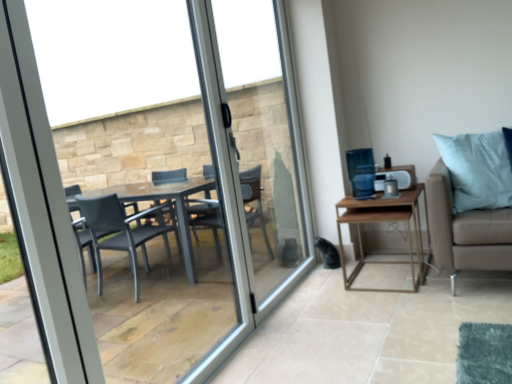
Question: Choose the correct answer: Is transparent glass window at center inside wooden table at right or outside it?

Choices:
 (A) outside
 (B) inside

Answer: (A)

Question: From a real-world perspective, relative to wooden table at right, is transparent glass window at center vertically above or below?

Choices:
 (A) above
 (B) below

Answer: (A)

Question: Which is farther from the wooden table at right?

Choices:
 (A) clear glass door at center
 (B) transparent glass window at center

Answer: (B)

Question: Based on their relative distances, which object is farther from the transparent glass window at center?

Choices:
 (A) clear glass door at center
 (B) wooden table at right

Answer: (B)